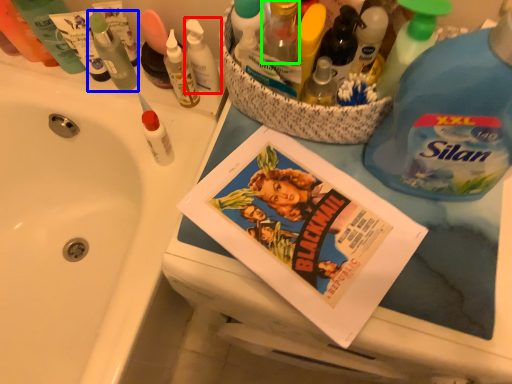
Question: Which object is the closest to the toiletry (highlighted by a red box)? Choose among these: toiletry (highlighted by a blue box) or toiletry (highlighted by a green box).

Choices:
 (A) toiletry
 (B) toiletry

Answer: (A)